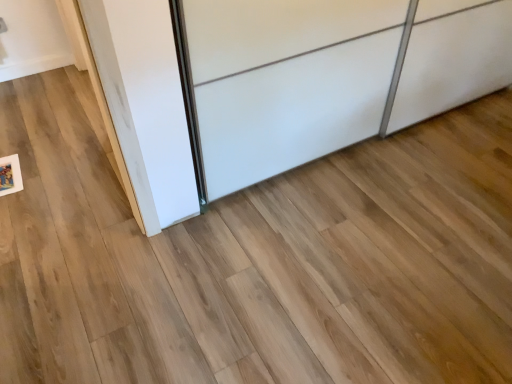
Where is `white glass screen door at center`? white glass screen door at center is located at coordinates (286, 80).

The image size is (512, 384). What do you see at coordinates (286, 80) in the screenshot?
I see `white glass screen door at center` at bounding box center [286, 80].

This screenshot has height=384, width=512. Identify the location of white glass screen door at center. (286, 80).